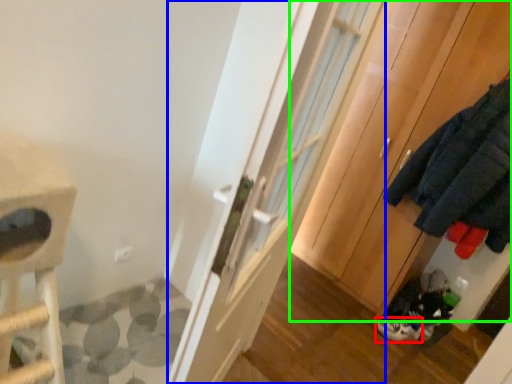
Question: Based on their relative distances, which object is farther from footwear (highlighted by a red box)? Choose from door (highlighted by a blue box) and cabinetry (highlighted by a green box).

Choices:
 (A) door
 (B) cabinetry

Answer: (A)